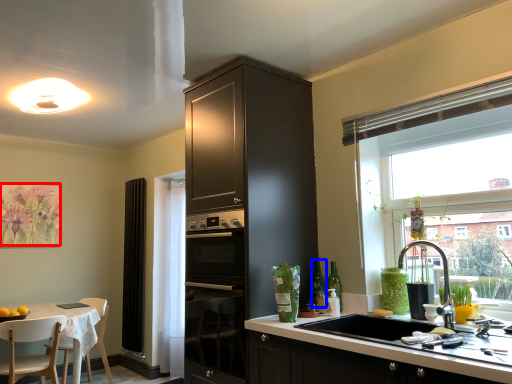
Question: Which object is further to the camera taking this photo, flower (highlighted by a red box) or bottle (highlighted by a blue box)?

Choices:
 (A) flower
 (B) bottle

Answer: (A)